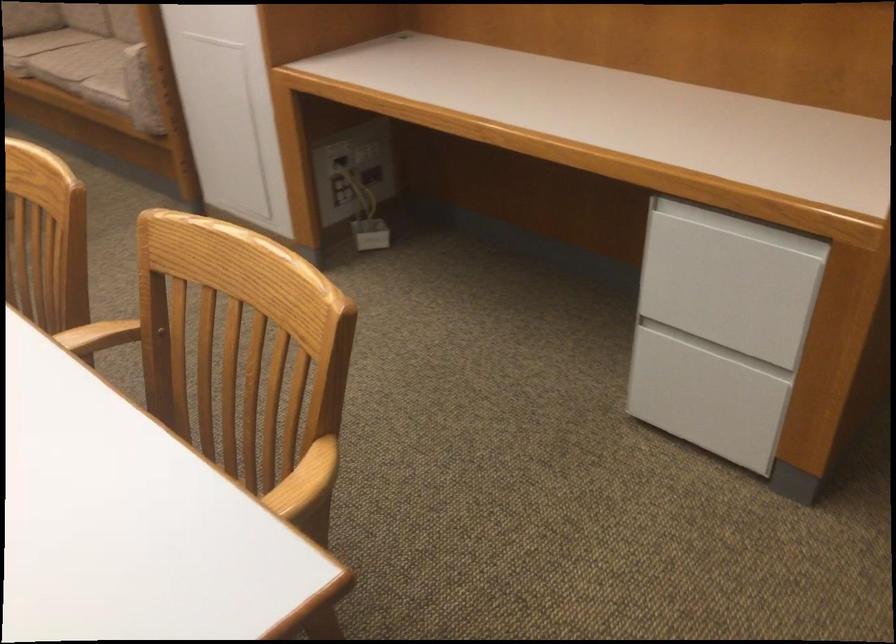
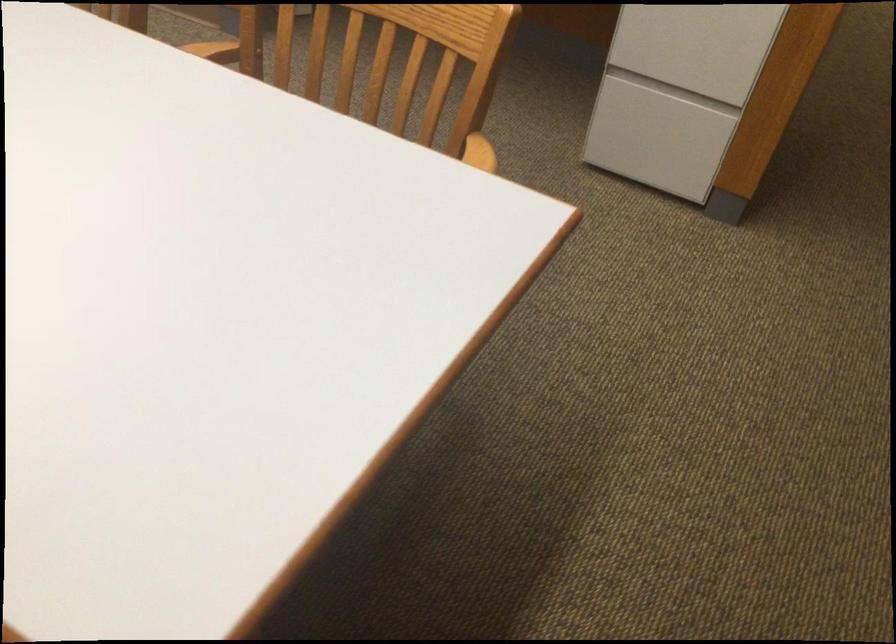
Where in the second image is the point corresponding to point 698,401 from the first image?

(661, 140)